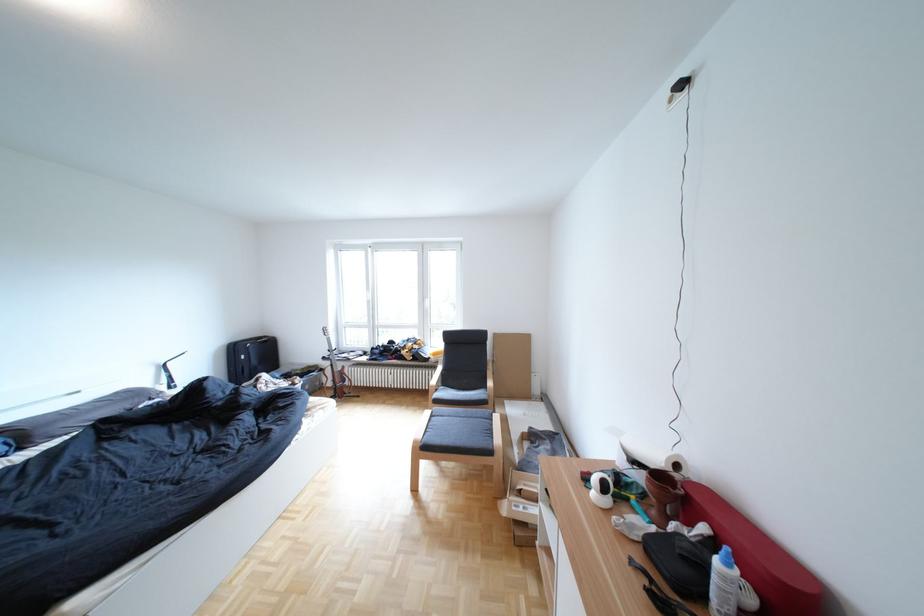
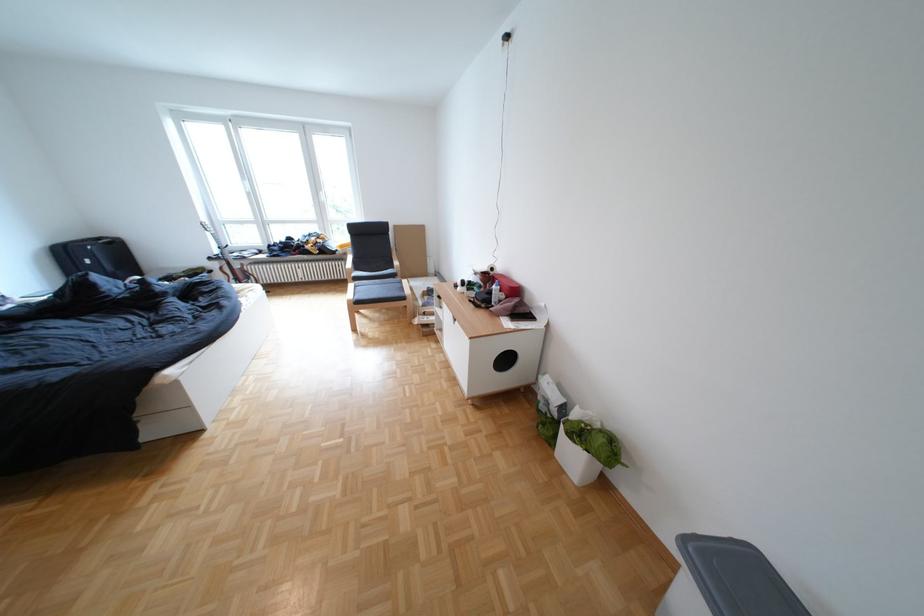
Locate, in the second image, the point that corresponds to [281,342] in the first image.

(126, 244)